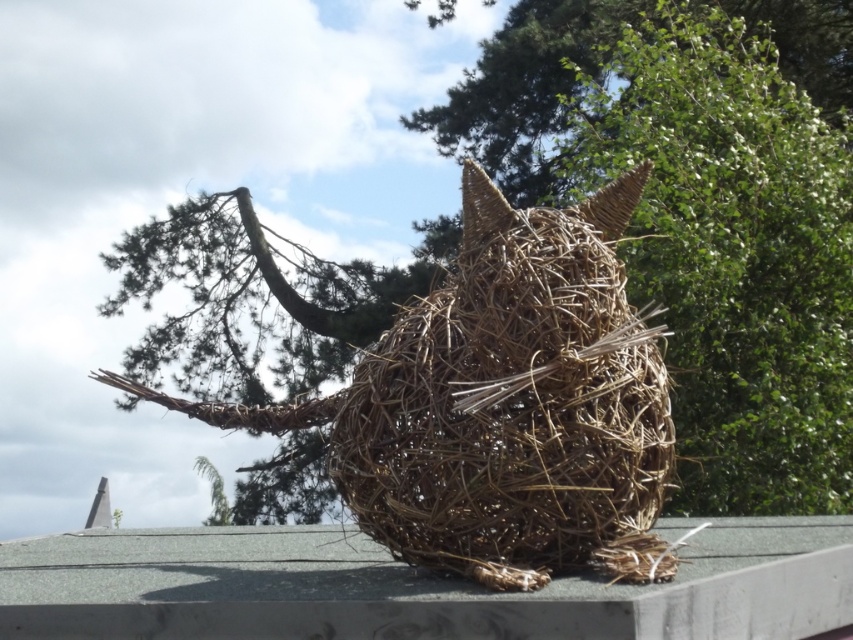
You are a delivery person trying to place a package on the smooth concrete ledge at center. The package is the same size as the braided straw cat at center. Will the package fit on the ledge?

The braided straw cat at center has a smaller size compared to smooth concrete ledge at center, so the package, being the same size as the braided straw cat at center, will fit on the smooth concrete ledge at center.

You are a delivery person trying to place a package on the smooth concrete ledge at center. The package is as thick as the braided straw cat at center. Will the package fit on the ledge?

The braided straw cat at center is thinner than the smooth concrete ledge at center. Since the package is as thick as the braided straw cat at center, it will fit on the ledge as the ledge is wider than the package.

You are a delivery drone with a 24 inch wide package. You need to land on the smooth concrete ledge at center to drop off the package. Can the braided straw cat at center be a problem for landing?

The braided straw cat at center is 25.24 inches away from the smooth concrete ledge at center. Since the distance is greater than the package width of 24 inches, the braided straw cat at center won not interfere with landing on the smooth concrete ledge at center.